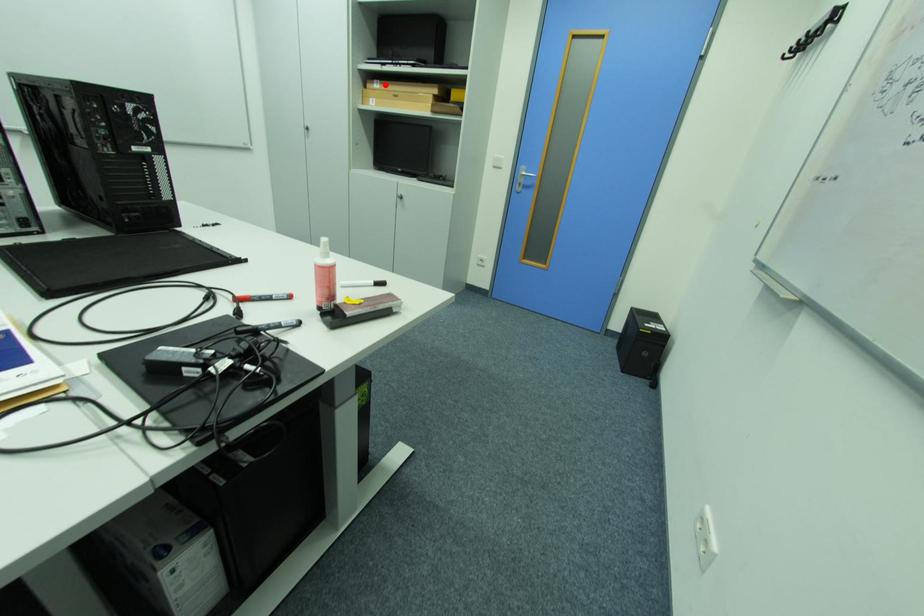
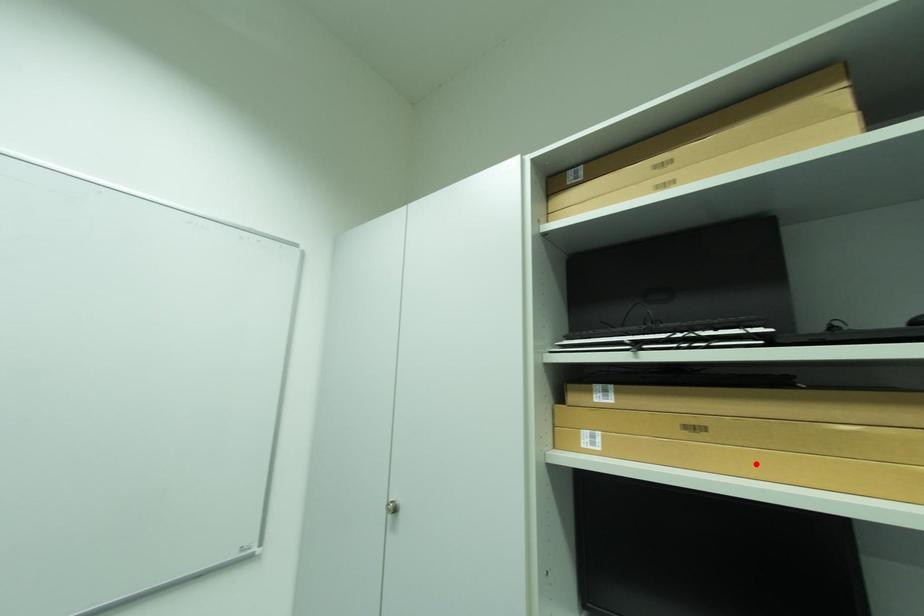
I am providing you with two images of the same scene from different viewpoints. A red point is marked on the first image and another point is marked on the second image. Do the highlighted points in image1 and image2 indicate the same real-world spot?

No